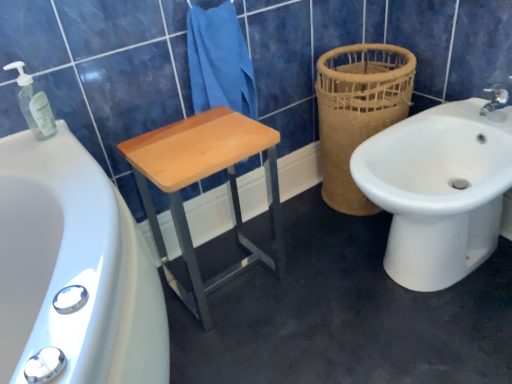
The image size is (512, 384). I want to click on free space behind light wood/matte stool at center, so click(x=251, y=230).